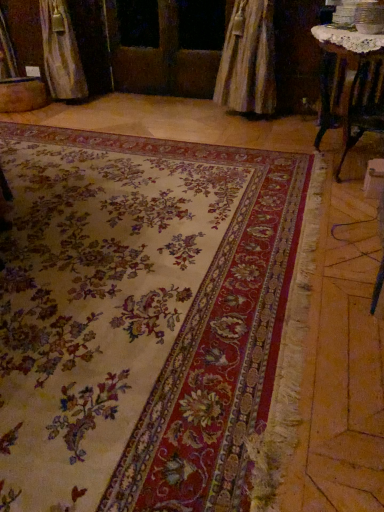
Where is `wooden screen door at center`? The height and width of the screenshot is (512, 384). wooden screen door at center is located at coordinates (166, 45).

In order to click on wooden screen door at center in this screenshot , I will do `click(166, 45)`.

Would you consider wooden table at upper right to be distant from wooden screen door at center?

Absolutely, wooden table at upper right is distant from wooden screen door at center.

Is wooden table at upper right positioned behind wooden screen door at center?

That is False.

Considering the positions of objects wooden table at upper right and wooden screen door at center in the image provided, who is more to the right, wooden table at upper right or wooden screen door at center?

From the viewer's perspective, wooden table at upper right appears more on the right side.

Identify the location of table that appears below the wooden screen door at center (from a real-world perspective). The image size is (384, 512). (344, 69).

Choose the correct answer: Is wooden screen door at center inside floral carpet at center or outside it?

wooden screen door at center is outside floral carpet at center.

Can you confirm if wooden screen door at center is taller than floral carpet at center?

Correct, wooden screen door at center is much taller as floral carpet at center.

How different are the orientations of wooden screen door at center and floral carpet at center in degrees?

wooden screen door at center and floral carpet at center are facing 0.633 degrees away from each other.

Considering the positions of objects wooden screen door at center and floral carpet at center in the image provided, who is in front, wooden screen door at center or floral carpet at center?

floral carpet at center is in front.

Is wooden table at upper right oriented towards floral carpet at center?

No, wooden table at upper right is not aimed at floral carpet at center.

Does point (378, 34) come in front of point (283, 377)?

That is False.

What's the angular difference between wooden table at upper right and floral carpet at center's facing directions?

wooden table at upper right and floral carpet at center are facing 91.3 degrees away from each other.

From a real-world perspective, is wooden table at upper right physically located above or below floral carpet at center?

wooden table at upper right is above floral carpet at center.

Is wooden screen door at center not within wooden table at upper right?

wooden screen door at center is positioned outside wooden table at upper right.

I want to click on table located underneath the wooden screen door at center (from a real-world perspective), so click(x=344, y=69).

Are wooden screen door at center and wooden table at upper right located far from each other?

Indeed, wooden screen door at center is not near wooden table at upper right.

Looking at this image, is wooden screen door at center bigger than wooden table at upper right?

No.

Which is closer to the camera, (16, 240) or (338, 63)?

Point (16, 240).

Can you confirm if floral carpet at center is wider than wooden table at upper right?

Yes, floral carpet at center is wider than wooden table at upper right.

Looking at this image, considering the sizes of objects floral carpet at center and wooden table at upper right in the image provided, who is bigger, floral carpet at center or wooden table at upper right?

floral carpet at center.

Is floral carpet at center far from wooden screen door at center?

Absolutely, floral carpet at center is distant from wooden screen door at center.

Is point (229, 410) positioned in front of point (191, 65)?

Yes, it is.

Between floral carpet at center and wooden screen door at center, which one is positioned behind?

wooden screen door at center is further away from the camera.

In the image, there is a wooden table at upper right. At what (x,y) coordinates should I click in order to perform the action: click on screen door above it (from the image's perspective). Please return your answer as a coordinate pair (x, y). The image size is (384, 512). Looking at the image, I should click on click(166, 45).

Identify the location of screen door lying behind the floral carpet at center. The image size is (384, 512). (166, 45).

Which object lies nearer to the anchor point floral carpet at center, wooden screen door at center or wooden table at upper right?

wooden table at upper right is closer to floral carpet at center.

From the picture: Considering their positions, is floral carpet at center positioned further to wooden screen door at center than wooden table at upper right?

The object further to wooden screen door at center is floral carpet at center.

Looking at the image, which one is located further to wooden table at upper right, floral carpet at center or wooden screen door at center?

Based on the image, wooden screen door at center appears to be further to wooden table at upper right.

Considering their positions, is wooden table at upper right positioned further to floral carpet at center than wooden screen door at center?

wooden screen door at center is positioned further to the anchor floral carpet at center.

Based on the photo, when comparing their distances from wooden table at upper right, does wooden screen door at center or floral carpet at center seem closer?

floral carpet at center.

Based on their spatial positions, is wooden table at upper right or floral carpet at center further from wooden screen door at center?

The object further to wooden screen door at center is floral carpet at center.

Locate an element on the screen. table between floral carpet at center and wooden screen door at center in the front-back direction is located at coordinates (344, 69).